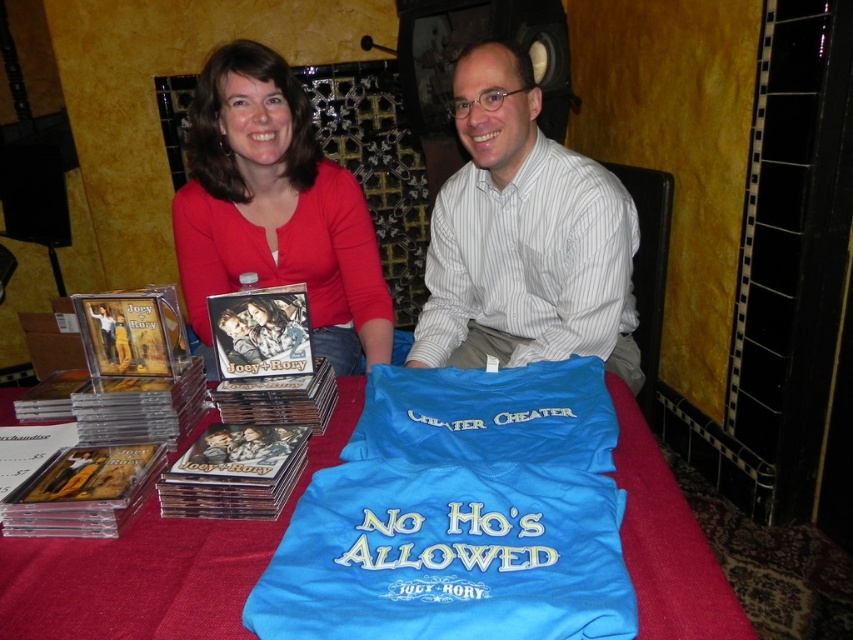
Between point (459, 337) and point (305, 172), which one is positioned behind?

Positioned behind is point (459, 337).

In order to click on white striped shirt at center in this screenshot , I will do `click(524, 237)`.

Between white striped shirt at center and blue fabric table at center, which one is positioned lower?

Positioned lower is blue fabric table at center.

The height and width of the screenshot is (640, 853). What do you see at coordinates (524, 237) in the screenshot? I see `white striped shirt at center` at bounding box center [524, 237].

Which is behind, point (469, 83) or point (171, 520)?

Positioned behind is point (469, 83).

At what (x,y) coordinates should I click in order to perform the action: click on white striped shirt at center. Please return your answer as a coordinate pair (x, y). This screenshot has height=640, width=853. Looking at the image, I should click on (524, 237).

Where is `blue fabric table at center`? The width and height of the screenshot is (853, 640). blue fabric table at center is located at coordinates (155, 564).

Is blue fabric table at center positioned before matte red shirt at upper left?

Yes, it is.

Describe the element at coordinates (155, 564) in the screenshot. I see `blue fabric table at center` at that location.

At what (x,y) coordinates should I click in order to perform the action: click on blue fabric table at center. Please return your answer as a coordinate pair (x, y). The width and height of the screenshot is (853, 640). Looking at the image, I should click on (155, 564).